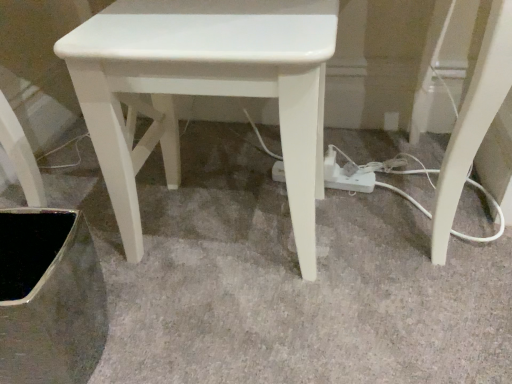
Question: Should I look upward or downward to see white matte stool at center?

Choices:
 (A) up
 (B) down

Answer: (A)

Question: Considering the relative sizes of white plastic extension cord at lower center and white matte stool at center in the image provided, is white plastic extension cord at lower center bigger than white matte stool at center?

Choices:
 (A) no
 (B) yes

Answer: (A)

Question: Is white plastic extension cord at lower center taller than white matte stool at center?

Choices:
 (A) no
 (B) yes

Answer: (A)

Question: Is white plastic extension cord at lower center outside of white matte stool at center?

Choices:
 (A) no
 (B) yes

Answer: (B)

Question: From the image's perspective, is white plastic extension cord at lower center located beneath white matte stool at center?

Choices:
 (A) yes
 (B) no

Answer: (A)

Question: From the image's perspective, is white plastic extension cord at lower center on top of white matte stool at center?

Choices:
 (A) yes
 (B) no

Answer: (B)

Question: From a real-world perspective, is white plastic extension cord at lower center under white matte stool at center?

Choices:
 (A) yes
 (B) no

Answer: (A)

Question: Is white matte stool at center surrounding white plastic extension cord at lower center?

Choices:
 (A) no
 (B) yes

Answer: (A)

Question: Is the position of white matte stool at center less distant than that of white plastic extension cord at lower center?

Choices:
 (A) yes
 (B) no

Answer: (A)

Question: Is white matte stool at center further to camera compared to white plastic extension cord at lower center?

Choices:
 (A) no
 (B) yes

Answer: (A)

Question: Can you confirm if white matte stool at center is shorter than white plastic extension cord at lower center?

Choices:
 (A) yes
 (B) no

Answer: (B)

Question: Is white matte stool at center thinner than white plastic extension cord at lower center?

Choices:
 (A) no
 (B) yes

Answer: (A)

Question: Does white matte stool at center turn towards white plastic extension cord at lower center?

Choices:
 (A) yes
 (B) no

Answer: (B)

Question: Does point (353, 187) appear closer or farther from the camera than point (309, 114)?

Choices:
 (A) farther
 (B) closer

Answer: (A)